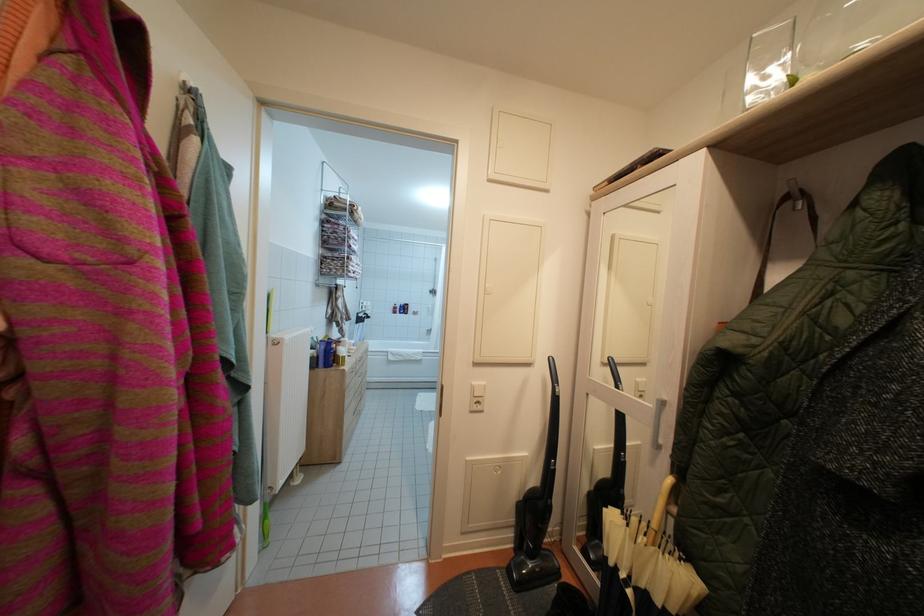
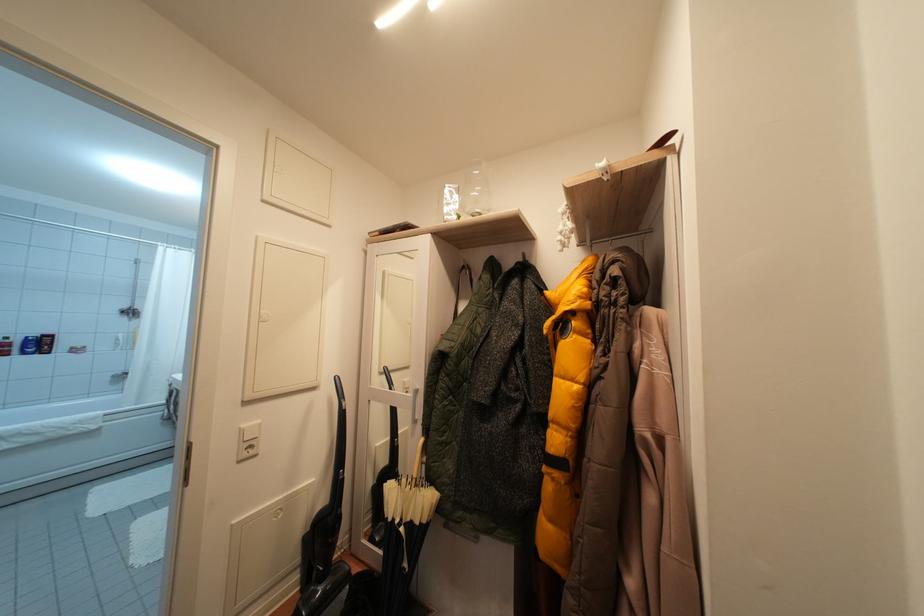
In the second image, find the point that corresponds to pixel 541 485 in the first image.

(331, 506)